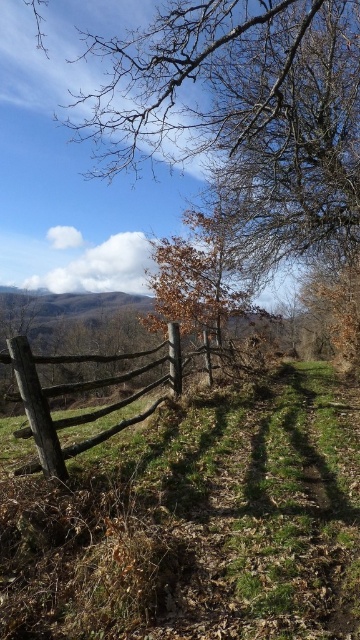
Question: Estimate the real-world distances between objects in this image. Which object is farther from the brown wood tree at upper center?

Choices:
 (A) brown matte tree at center
 (B) rustic wooden fence at center

Answer: (B)

Question: Can you confirm if brown matte tree at center is bigger than rustic wooden fence at center?

Choices:
 (A) no
 (B) yes

Answer: (B)

Question: Which is farther from the brown matte tree at center?

Choices:
 (A) rustic wooden fence at center
 (B) brown wood tree at upper center

Answer: (A)

Question: From the image, what is the correct spatial relationship of brown wood tree at upper center in relation to brown matte tree at center?

Choices:
 (A) above
 (B) below

Answer: (A)

Question: Considering the real-world distances, which object is farthest from the brown wood tree at upper center?

Choices:
 (A) rustic wooden fence at center
 (B) brown matte tree at center

Answer: (A)

Question: Is brown wood tree at upper center to the left of brown matte tree at center from the viewer's perspective?

Choices:
 (A) no
 (B) yes

Answer: (A)